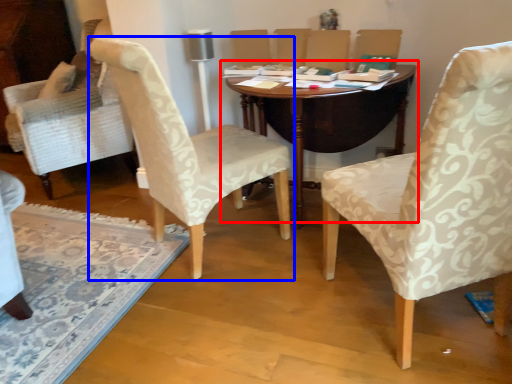
Question: Which object appears farthest to the camera in this image, table (highlighted by a red box) or chair (highlighted by a blue box)?

Choices:
 (A) table
 (B) chair

Answer: (A)